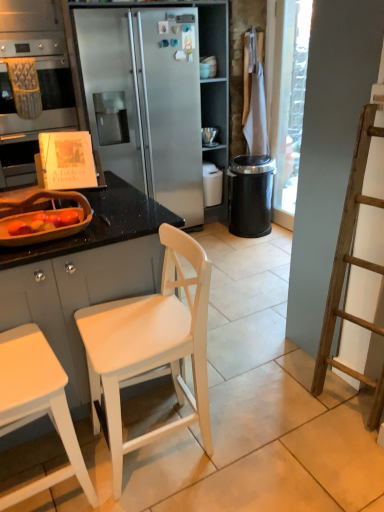
Question: From a real-world perspective, is white wood chair at center on black plastic trash can at center-right?

Choices:
 (A) yes
 (B) no

Answer: (A)

Question: Is white wood chair at center placed right next to black plastic trash can at center-right?

Choices:
 (A) yes
 (B) no

Answer: (B)

Question: Does white wood chair at center have a smaller size compared to black plastic trash can at center-right?

Choices:
 (A) yes
 (B) no

Answer: (B)

Question: Is white wood chair at center positioned with its back to black plastic trash can at center-right?

Choices:
 (A) yes
 (B) no

Answer: (B)

Question: Is black plastic trash can at center-right completely or partially inside white wood chair at center?

Choices:
 (A) no
 (B) yes

Answer: (A)

Question: From a real-world perspective, is white wood chair at center above or below black plastic trash can at center-right?

Choices:
 (A) below
 (B) above

Answer: (B)

Question: From the image's perspective, is white wood chair at center located above or below black plastic trash can at center-right?

Choices:
 (A) below
 (B) above

Answer: (A)

Question: In the image, is white wood chair at center on the left side or the right side of black plastic trash can at center-right?

Choices:
 (A) left
 (B) right

Answer: (A)

Question: Looking at their shapes, would you say white wood chair at center is wider or thinner than black plastic trash can at center-right?

Choices:
 (A) wide
 (B) thin

Answer: (A)

Question: In the image, is wooden bowl at left positioned in front of or behind white wood chair at center?

Choices:
 (A) front
 (B) behind

Answer: (B)

Question: Is wooden bowl at left spatially inside white wood chair at center, or outside of it?

Choices:
 (A) outside
 (B) inside

Answer: (A)

Question: Considering the positions of wooden bowl at left and white wood chair at center in the image, is wooden bowl at left wider or thinner than white wood chair at center?

Choices:
 (A) thin
 (B) wide

Answer: (A)

Question: Looking at the image, does wooden bowl at left seem bigger or smaller compared to white wood chair at center?

Choices:
 (A) small
 (B) big

Answer: (A)

Question: Does point (31, 256) appear closer or farther from the camera than point (100, 321)?

Choices:
 (A) farther
 (B) closer

Answer: (B)

Question: Considering their positions, is white matte cabinet at left, the second cabinetry positioned from the top, located in front of or behind white wood chair at center?

Choices:
 (A) behind
 (B) front

Answer: (A)